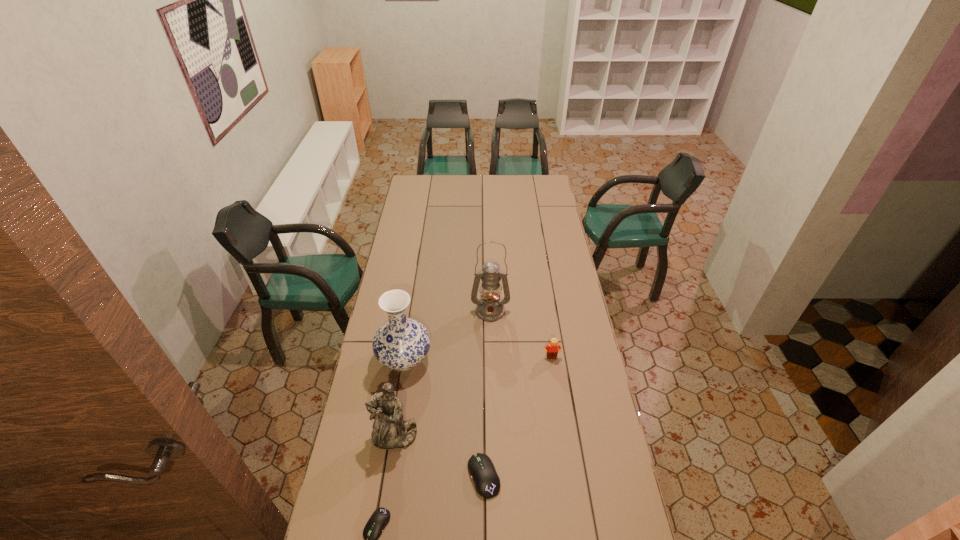
In the image, there is a desktop. At what (x,y) coordinates should I click in order to perform the action: click on free space at the far left corner. Please return your answer as a coordinate pair (x, y). Image resolution: width=960 pixels, height=540 pixels. Looking at the image, I should click on (417, 187).

At what (x,y) coordinates should I click in order to perform the action: click on empty space that is in between the vase and the third nearest object. Please return your answer as a coordinate pair (x, y). The width and height of the screenshot is (960, 540). Looking at the image, I should click on (399, 398).

You are a GUI agent. You are given a task and a screenshot of the screen. Output one action in this format:
    pyautogui.click(x=<x>, y=<y>)
    Task: Click on the vacant region between the figurine and the Lego
    
    Given the screenshot: What is the action you would take?
    pyautogui.click(x=473, y=397)

The image size is (960, 540). Identify the location of free spot between the vase and the figurine. (399, 398).

This screenshot has width=960, height=540. What are the coordinates of `free space between the fourth farthest object and the oil lamp` in the screenshot? It's located at (443, 374).

You are a GUI agent. You are given a task and a screenshot of the screen. Output one action in this format:
    pyautogui.click(x=<x>, y=<y>)
    Task: Click on the free space that is in between the rightmost object and the figurine
    
    Given the screenshot: What is the action you would take?
    pyautogui.click(x=473, y=397)

The width and height of the screenshot is (960, 540). What are the coordinates of `object that can be found as the second closest to the fifth shortest object` in the screenshot? It's located at (490, 307).

Point out which object is positioned as the third nearest to the right computer equipment. Please provide its 2D coordinates. Your answer should be formatted as a tuple, i.e. [(x, y)], where the tuple contains the x and y coordinates of a point satisfying the conditions above.

[(401, 343)]

The height and width of the screenshot is (540, 960). In order to click on vacant region that satisfies the following two spatial constraints: 1. on the front-facing side of the fifth tallest object; 2. on the left side of the fourth farthest object in this screenshot , I will do `click(388, 476)`.